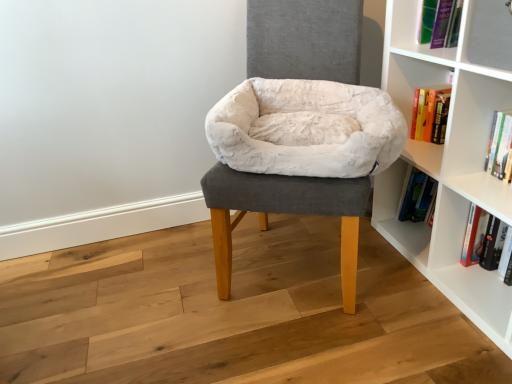
The height and width of the screenshot is (384, 512). I want to click on vacant point to the left of white plush pet bed at center, so tap(158, 288).